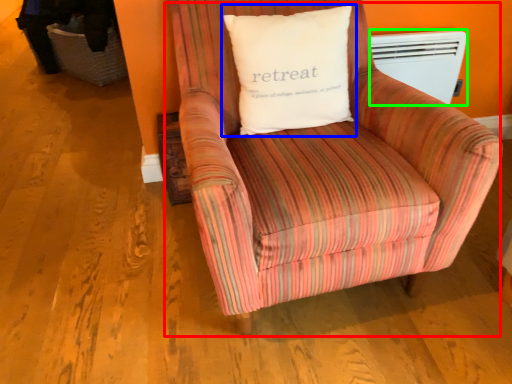
Question: Which is farther away from chair (highlighted by a red box)? pillow (highlighted by a blue box) or heater (highlighted by a green box)?

Choices:
 (A) pillow
 (B) heater

Answer: (B)